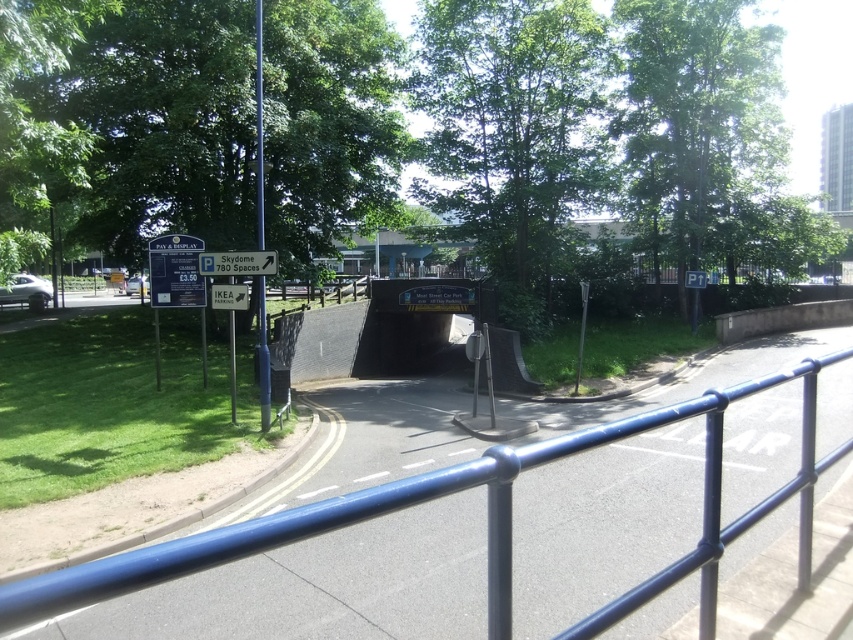
Question: Which point is closer to the camera?

Choices:
 (A) metallic blue railing at center
 (B) green leafy tree at upper left

Answer: (A)

Question: Does blue plastic sign at upper left appear on the right side of white plastic sign at upper left?

Choices:
 (A) no
 (B) yes

Answer: (A)

Question: Which object is the farthest from the matte black car at left?

Choices:
 (A) blue plastic sign at upper left
 (B) metallic blue railing at center

Answer: (B)

Question: Is blue plastic sign at upper left behind white plastic sign at center?

Choices:
 (A) no
 (B) yes

Answer: (B)

Question: Does matte black car at left appear over white plastic sign at center?

Choices:
 (A) yes
 (B) no

Answer: (A)

Question: Estimate the real-world distances between objects in this image. Which object is closer to the green leafy tree at upper right?

Choices:
 (A) white plastic sign at center
 (B) blue plastic sign at upper left

Answer: (B)